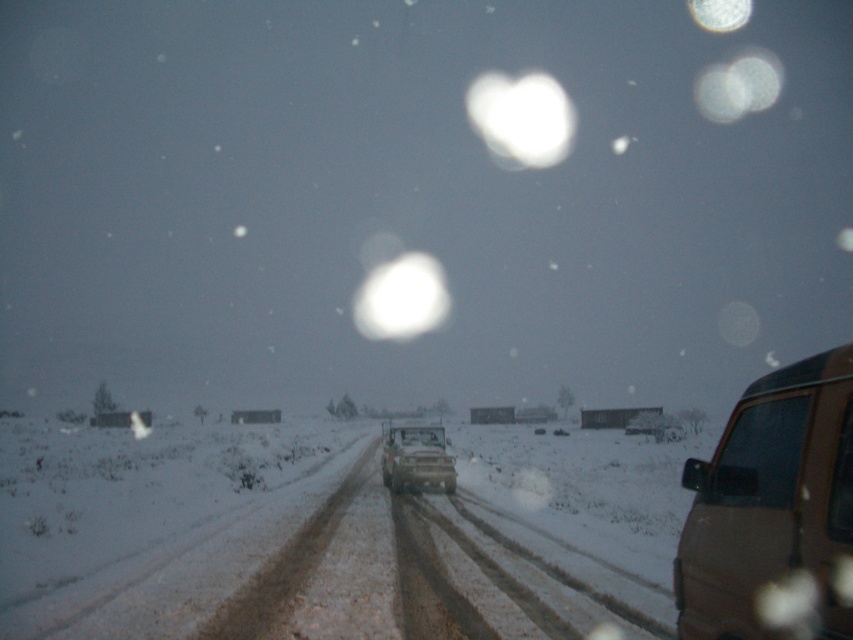
Question: Does brown matte van at right have a smaller size compared to metallic silver truck at center?

Choices:
 (A) yes
 (B) no

Answer: (B)

Question: Does snowy dirt road at center have a greater width compared to brown matte van at right?

Choices:
 (A) no
 (B) yes

Answer: (B)

Question: Can you confirm if snowy dirt road at center is positioned below metallic silver truck at center?

Choices:
 (A) yes
 (B) no

Answer: (A)

Question: Estimate the real-world distances between objects in this image. Which object is closer to the metallic silver truck at center?

Choices:
 (A) brown matte van at right
 (B) snowy dirt road at center

Answer: (B)

Question: Which is farther from the metallic silver truck at center?

Choices:
 (A) brown matte van at right
 (B) snowy dirt road at center

Answer: (A)

Question: Which point is closer to the camera?

Choices:
 (A) (543, 561)
 (B) (805, 557)

Answer: (B)